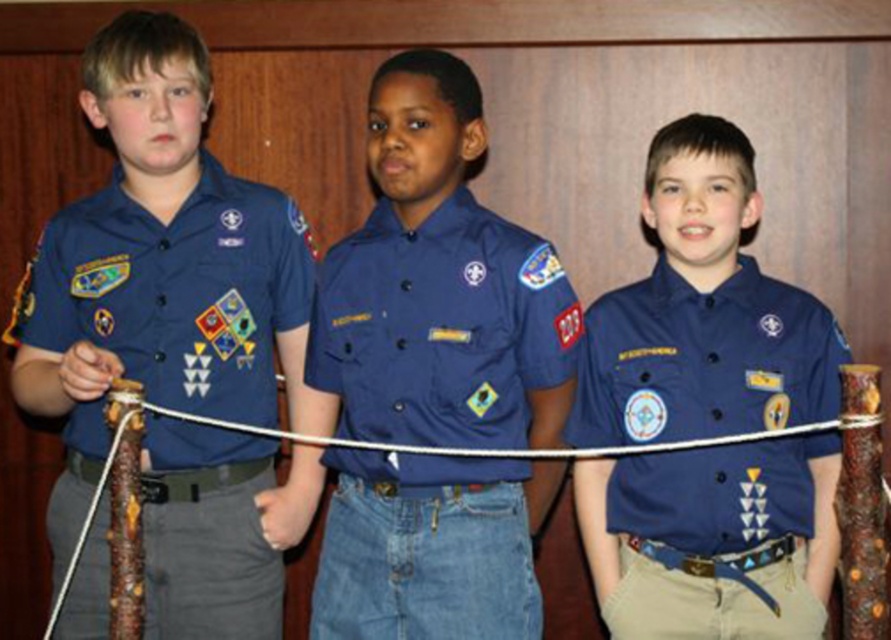
Does blue cotton shirt at center appear under matte blue shirt at center?

Incorrect, blue cotton shirt at center is not positioned below matte blue shirt at center.

Where is `blue cotton shirt at center`? Image resolution: width=891 pixels, height=640 pixels. blue cotton shirt at center is located at coordinates (440, 326).

Image resolution: width=891 pixels, height=640 pixels. Find the location of `blue cotton shirt at center`. blue cotton shirt at center is located at coordinates (440, 326).

Identify the location of blue cotton shirt at center. This screenshot has height=640, width=891. (440, 326).

How far apart are matte blue shirt at left and matte blue shirt at center?

32.83 inches

In the scene shown: Between matte blue shirt at left and matte blue shirt at center, which one is positioned higher?

Positioned higher is matte blue shirt at left.

Between point (71, 481) and point (642, 586), which one is positioned behind?

Positioned behind is point (71, 481).

Identify the location of matte blue shirt at left. (176, 291).

Between blue cotton shirt at center and matte blue shirt at left, which one appears on the right side from the viewer's perspective?

blue cotton shirt at center

Is blue cotton shirt at center thinner than matte blue shirt at left?

Yes.

Is point (503, 416) in front of point (75, 202)?

Yes, point (503, 416) is closer to viewer.

Where is `blue cotton shirt at center`? This screenshot has height=640, width=891. blue cotton shirt at center is located at coordinates (440, 326).